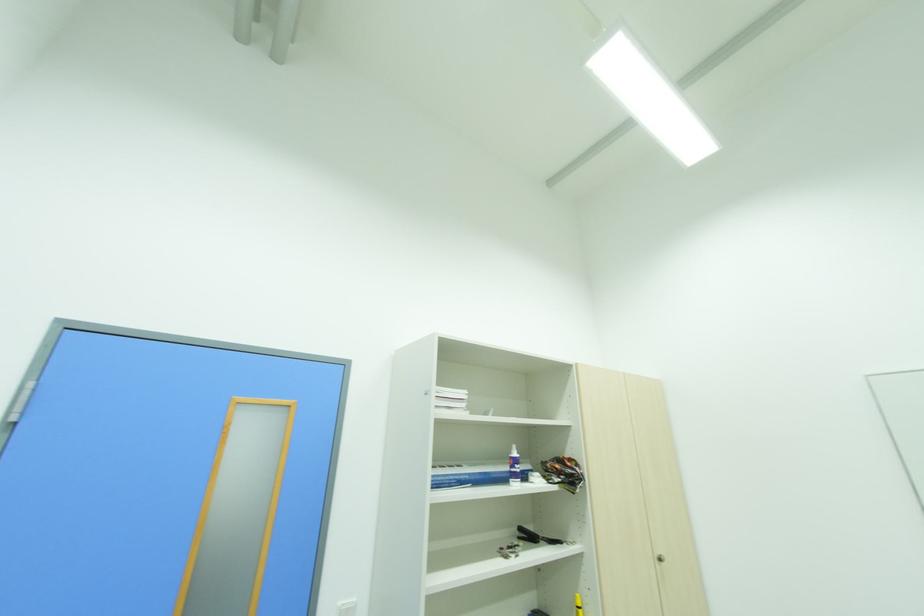
The width and height of the screenshot is (924, 616). In order to click on blue and white box in this screenshot , I will do `click(473, 474)`.